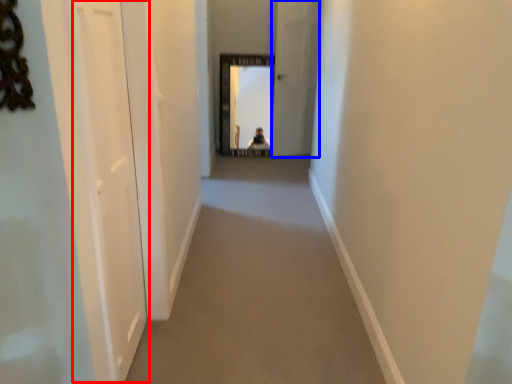
Question: Which of the following is the farthest to the observer, screen door (highlighted by a red box) or screen door (highlighted by a blue box)?

Choices:
 (A) screen door
 (B) screen door

Answer: (B)